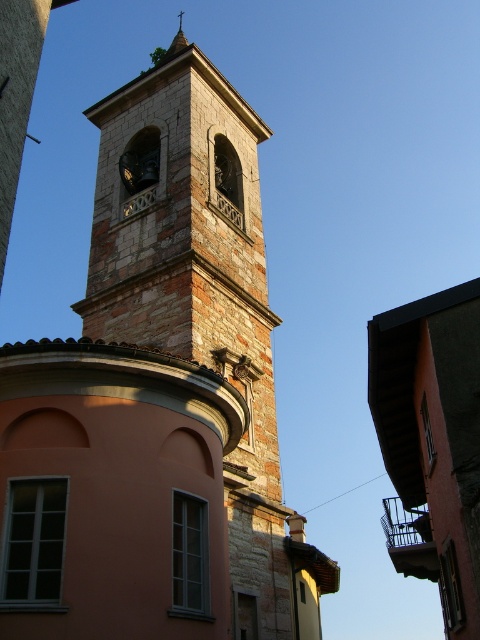
You are standing in front of the historic stone bell tower and want to take a photo. There are two points marked on the tower at coordinates point (93, 598) and point (175, 49). Which point will appear larger in your photo?

Point (93, 598) is closer to the camera than point (175, 49), so it will appear larger in the photo.

You are standing in front of the historic stone bell tower and want to take a photo that includes both the stone bell tower at center and the smooth stone spire at upper center. Based on their positions, which object should you place on the right side of your camera frame to ensure both are visible?

The stone bell tower at center is positioned on the right side of smooth stone spire at upper center, so to include both in your photo, you should place the stone bell tower at center on the right side of your camera frame.

You are standing in front of the historic stone bell tower and want to take a photo that includes both the stone bell tower at center and the smooth stone spire at upper center. Which object should you focus on first to ensure both are in frame?

The stone bell tower at center is located below the smooth stone spire at upper center, so you should focus on the stone bell tower at center first to ensure both are in frame.